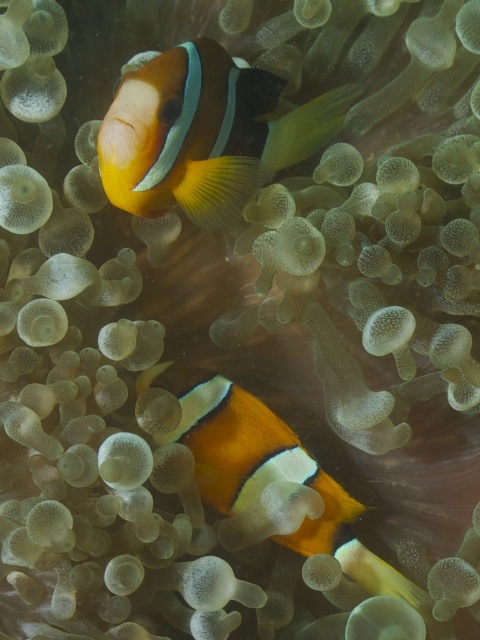
Based on the photo, which of these two, orange matte clownfish at upper center or orange matte clownfish at center, stands shorter?

orange matte clownfish at upper center

Is orange matte clownfish at upper center in front of orange matte clownfish at center?

That is True.

Locate an element on the screen. The image size is (480, 640). orange matte clownfish at upper center is located at coordinates 204,132.